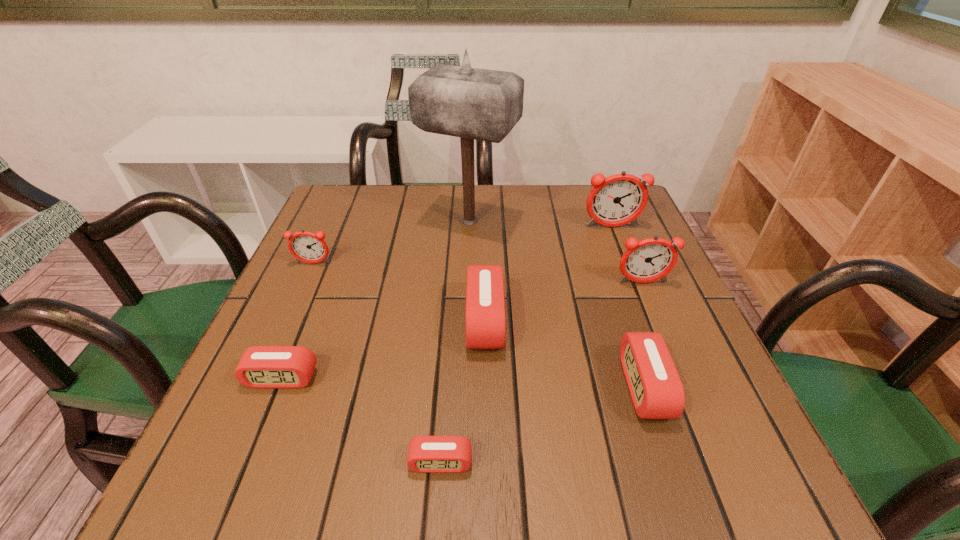
The image size is (960, 540). Find the location of `free space between the third farthest alarm clock and the shortest object`. free space between the third farthest alarm clock and the shortest object is located at coordinates 541,373.

Locate an element on the screen. The height and width of the screenshot is (540, 960). free space between the biggest pink alarm clock and the biggest reddish-pink alarm clock is located at coordinates (548, 274).

At what (x,y) coordinates should I click in order to perform the action: click on free space between the second shortest object and the leftmost reddish-pink alarm clock. Please return your answer as a coordinate pair (x, y). Looking at the image, I should click on (298, 321).

Identify the location of empty space that is in between the smallest pink alarm clock and the smallest reddish-pink alarm clock. This screenshot has width=960, height=540. (377, 363).

The width and height of the screenshot is (960, 540). What are the coordinates of `the fifth closest object to the leftmost pink alarm clock` in the screenshot? It's located at (655, 387).

Choose which object is the nearest neighbor to the second farthest reddish-pink alarm clock. Please provide its 2D coordinates. Your answer should be formatted as a tuple, i.e. [(x, y)], where the tuple contains the x and y coordinates of a point satisfying the conditions above.

[(475, 104)]

Select which alarm clock is the closest to the biggest pink alarm clock. Please provide its 2D coordinates. Your answer should be formatted as a tuple, i.e. [(x, y)], where the tuple contains the x and y coordinates of a point satisfying the conditions above.

[(426, 454)]

Locate which alarm clock is the second closest to the third smallest pink alarm clock. Please provide its 2D coordinates. Your answer should be formatted as a tuple, i.e. [(x, y)], where the tuple contains the x and y coordinates of a point satisfying the conditions above.

[(485, 306)]

Choose which reddish-pink alarm clock is the nearest neighbor to the second tallest object. Please provide its 2D coordinates. Your answer should be formatted as a tuple, i.e. [(x, y)], where the tuple contains the x and y coordinates of a point satisfying the conditions above.

[(652, 259)]

At what (x,y) coordinates should I click in order to perform the action: click on reddish-pink alarm clock that stands as the third closest to the biggest pink alarm clock. Please return your answer as a coordinate pair (x, y). The image size is (960, 540). Looking at the image, I should click on (307, 247).